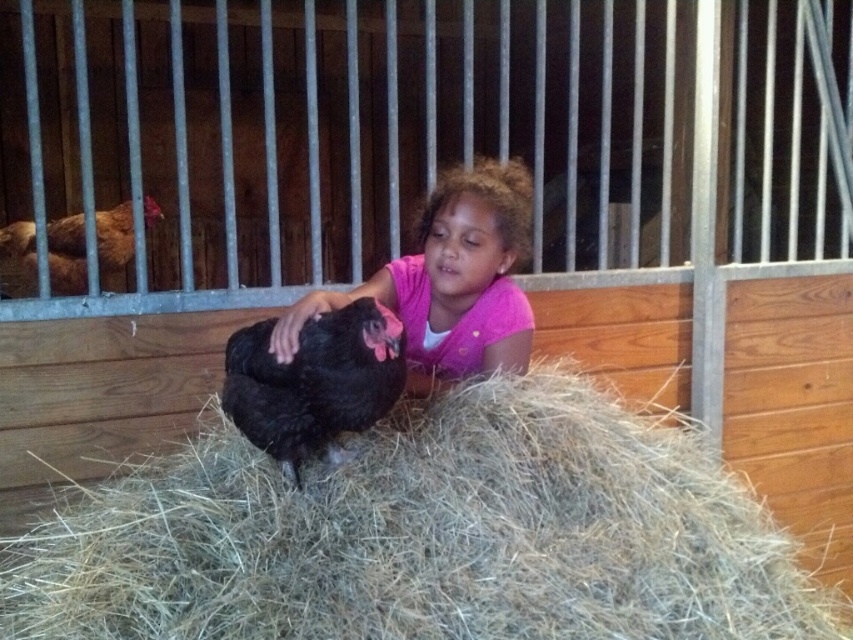
Does pink matte shirt at center have a greater width compared to brown feathered chicken at left?

Indeed, pink matte shirt at center has a greater width compared to brown feathered chicken at left.

Consider the image. Does pink matte shirt at center have a lesser width compared to brown feathered chicken at left?

No.

What do you see at coordinates (451, 278) in the screenshot? The width and height of the screenshot is (853, 640). I see `pink matte shirt at center` at bounding box center [451, 278].

The image size is (853, 640). In order to click on pink matte shirt at center in this screenshot , I will do `click(451, 278)`.

Which is behind, point (486, 266) or point (352, 387)?

Point (486, 266)

Can you confirm if pink matte shirt at center is thinner than black feathered chicken at center?

In fact, pink matte shirt at center might be wider than black feathered chicken at center.

At what (x,y) coordinates should I click in order to perform the action: click on pink matte shirt at center. Please return your answer as a coordinate pair (x, y). Looking at the image, I should click on (451, 278).

The image size is (853, 640). In order to click on pink matte shirt at center in this screenshot , I will do `click(451, 278)`.

Which of these two, light brown straw at center or pink matte shirt at center, stands shorter?

light brown straw at center

Which is behind, point (338, 637) or point (508, 307)?

The point (508, 307) is behind.

Where is `light brown straw at center`? light brown straw at center is located at coordinates (426, 536).